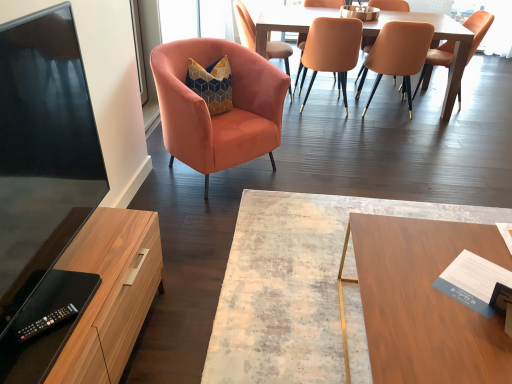
Identify the location of free point behind wooden rectangular table at center. This screenshot has width=512, height=384. (381, 157).